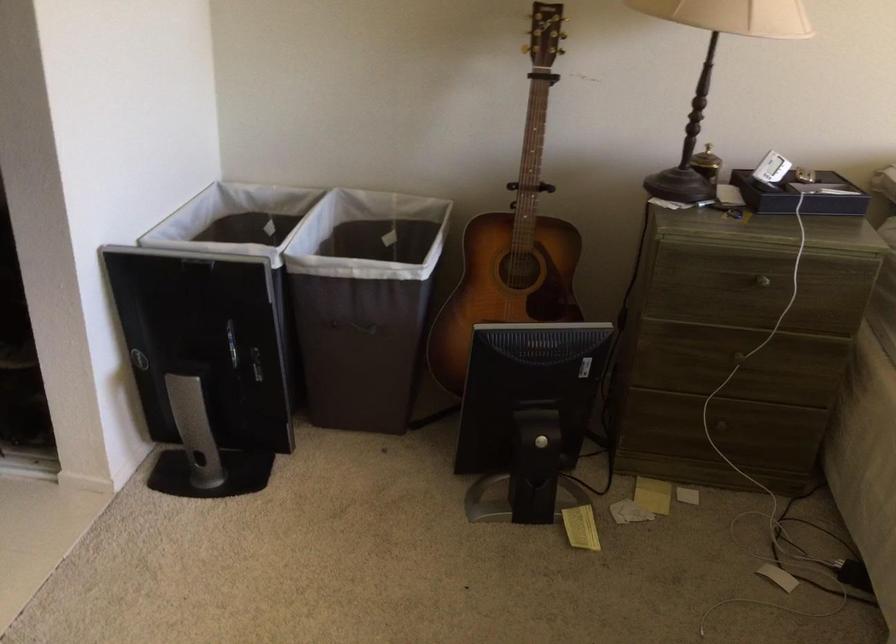
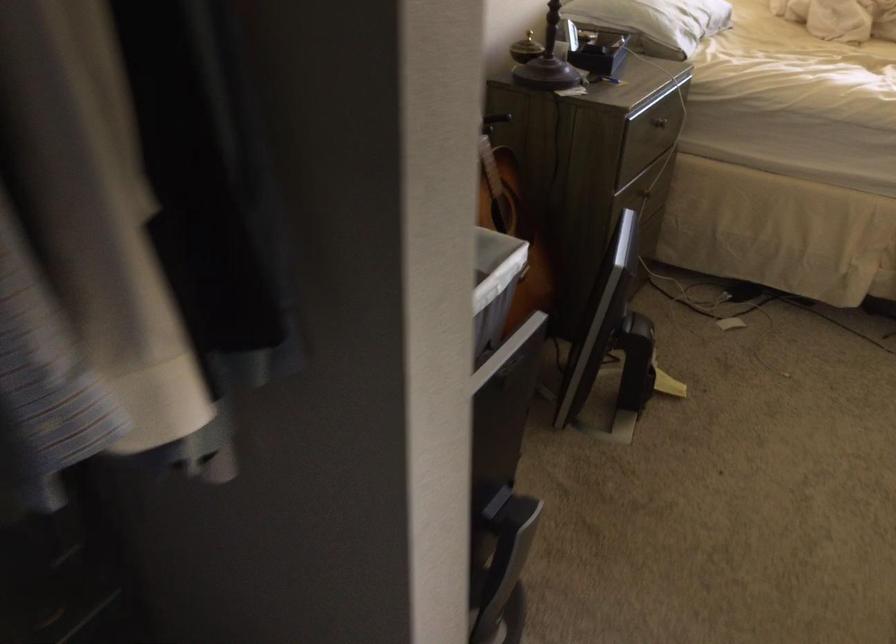
Question: I am providing you with two images of the same scene from different viewpoints. Which of the following objects are not visible in image2?

Choices:
 (A) acoustic guitar
 (B) drawer knob
 (C) fabric hamper handle
 (D) blue bean bag chair

Answer: (C)